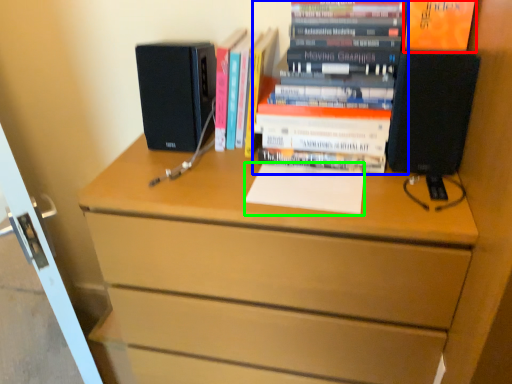
Question: Based on their relative distances, which object is nearer to paperback book (highlighted by a red box)? Choose from book (highlighted by a blue box) and notepad (highlighted by a green box).

Choices:
 (A) book
 (B) notepad

Answer: (A)